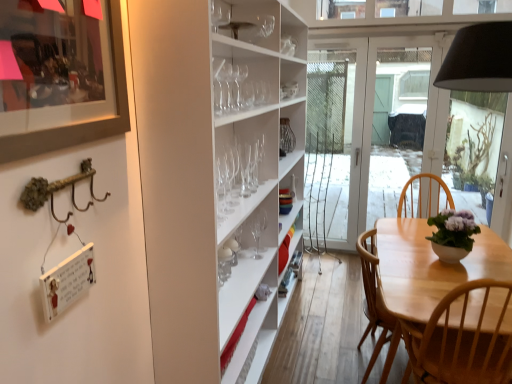
Question: Does clear glass wine glass at center, the fifth wine glass positioned from the front, appear on the right side of clear glass wine glass at center, placed as the third wine glass when sorted from back to front?

Choices:
 (A) yes
 (B) no

Answer: (A)

Question: Considering the relative positions of clear glass wine glass at center, the fifth wine glass positioned from the front, and clear glass wine glass at center, which ranks as the fourth wine glass in front-to-back order, in the image provided, is clear glass wine glass at center, the fifth wine glass positioned from the front, to the left of clear glass wine glass at center, which ranks as the fourth wine glass in front-to-back order, from the viewer's perspective?

Choices:
 (A) yes
 (B) no

Answer: (B)

Question: Would you say clear glass wine glass at center, the second wine glass viewed from the back, is outside clear glass wine glass at center, placed as the third wine glass when sorted from back to front?

Choices:
 (A) yes
 (B) no

Answer: (A)

Question: Would you say clear glass wine glass at center, placed as the third wine glass when sorted from back to front, is part of clear glass wine glass at center, the fifth wine glass positioned from the front,'s contents?

Choices:
 (A) no
 (B) yes

Answer: (A)

Question: Is clear glass wine glass at center, the second wine glass viewed from the back, closer to camera compared to clear glass wine glass at center, which ranks as the fourth wine glass in front-to-back order?

Choices:
 (A) no
 (B) yes

Answer: (A)

Question: From a real-world perspective, is clear glass wine glass at center, the fifth wine glass positioned from the front, positioned under clear glass wine glass at center, which ranks as the fourth wine glass in front-to-back order, based on gravity?

Choices:
 (A) no
 (B) yes

Answer: (A)

Question: From the image's perspective, is clear glass vase at center on top of light wood chair at lower right?

Choices:
 (A) yes
 (B) no

Answer: (A)

Question: Would you say clear glass vase at center is outside light wood chair at lower right?

Choices:
 (A) yes
 (B) no

Answer: (A)

Question: Is clear glass vase at center touching light wood chair at lower right?

Choices:
 (A) no
 (B) yes

Answer: (A)

Question: Is clear glass vase at center looking in the opposite direction of light wood chair at lower right?

Choices:
 (A) no
 (B) yes

Answer: (A)

Question: Is clear glass vase at center bigger than light wood chair at lower right?

Choices:
 (A) no
 (B) yes

Answer: (A)

Question: Is clear glass vase at center far from light wood chair at lower right?

Choices:
 (A) no
 (B) yes

Answer: (B)

Question: From a real-world perspective, is matte black picture frame at upper left beneath purple matte flowerpot at center?

Choices:
 (A) no
 (B) yes

Answer: (A)